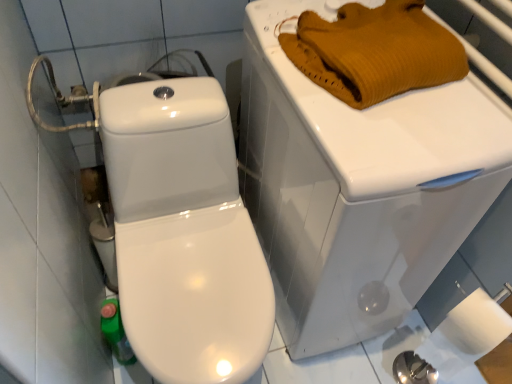
Question: Is point (339, 36) closer or farther from the camera than point (310, 180)?

Choices:
 (A) farther
 (B) closer

Answer: (A)

Question: From the image's perspective, relative to white glossy porcelain at upper right, is knitted wool sweater at upper right above or below?

Choices:
 (A) below
 (B) above

Answer: (B)

Question: In terms of width, does knitted wool sweater at upper right look wider or thinner when compared to white glossy porcelain at upper right?

Choices:
 (A) wide
 (B) thin

Answer: (B)

Question: From the image's perspective, is white glossy porcelain at upper right located above or below knitted wool sweater at upper right?

Choices:
 (A) above
 (B) below

Answer: (B)

Question: Is white glossy porcelain at upper right bigger or smaller than knitted wool sweater at upper right?

Choices:
 (A) small
 (B) big

Answer: (B)

Question: Considering the positions of point (320, 266) and point (429, 51), is point (320, 266) closer or farther from the camera than point (429, 51)?

Choices:
 (A) farther
 (B) closer

Answer: (A)

Question: Looking at their shapes, would you say white glossy porcelain at upper right is wider or thinner than knitted wool sweater at upper right?

Choices:
 (A) wide
 (B) thin

Answer: (A)